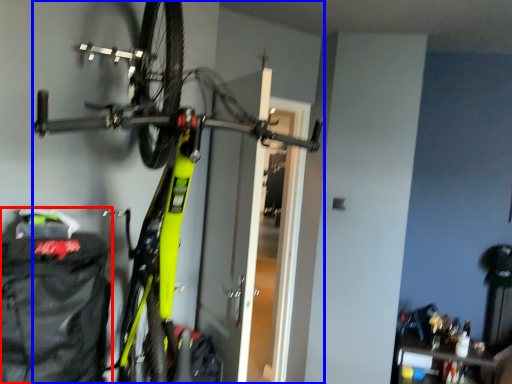
Question: Among these objects, which one is nearest to the camera, backpack (highlighted by a red box) or bicycle (highlighted by a blue box)?

Choices:
 (A) backpack
 (B) bicycle

Answer: (B)